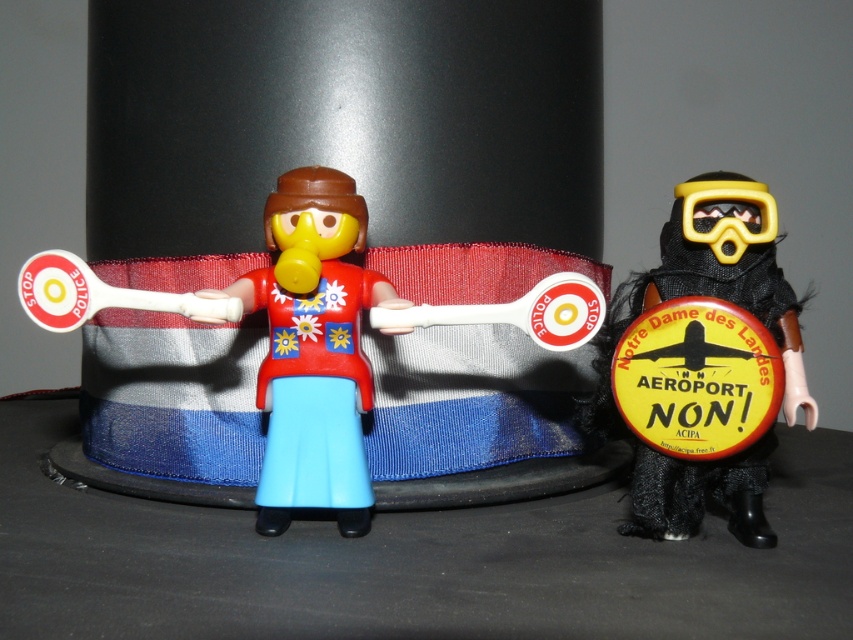
You are a child playing with toys and you see a point at coordinates (335, 333). What is located at that point?

The point at coordinates (335, 333) indicates a matte plastic toy at center.

Looking at this image, you are a child trying to place a 5 inch long toy car between the matte plastic toy at center and the black fabric mask at right. Can the toy car fit in the space between them?

The distance between the matte plastic toy at center and the black fabric mask at right is 6.07 inches. Since the toy car is 5 inches long, it can fit in the space between them as there is enough room.

You have a small box that can only hold items narrower than the black fabric mask at right. Can the matte plastic toy at center fit into the box?

The matte plastic toy at center is wider than the black fabric mask at right, so it cannot fit into the box designed for items narrower than the black fabric mask at right.